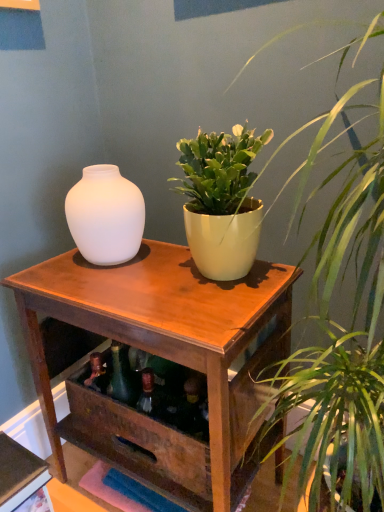
Find the location of a particular element. The image size is (384, 512). free location to the right of matte white vase at left is located at coordinates (158, 256).